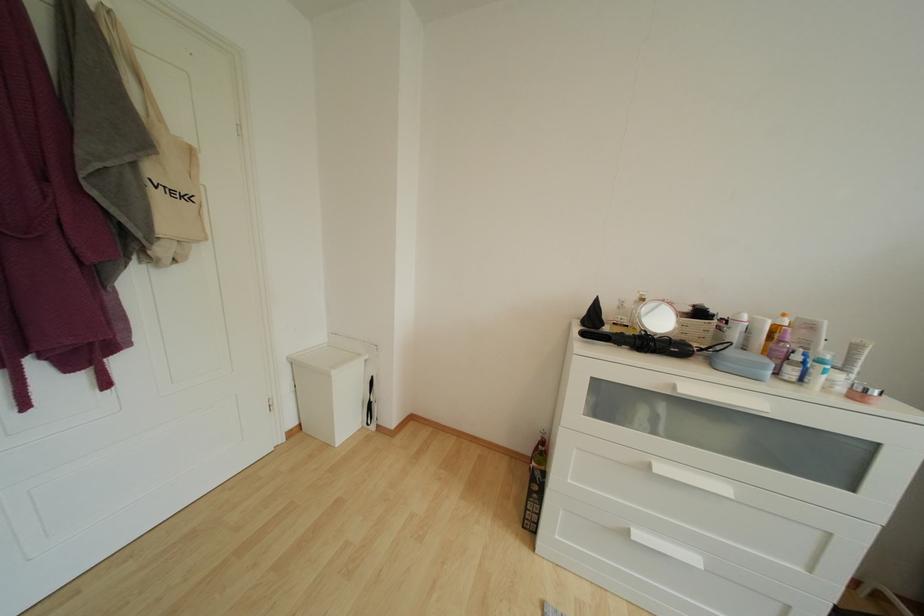
Describe the element at coordinates (636, 310) in the screenshot. Image resolution: width=924 pixels, height=616 pixels. I see `a white bottle pump` at that location.